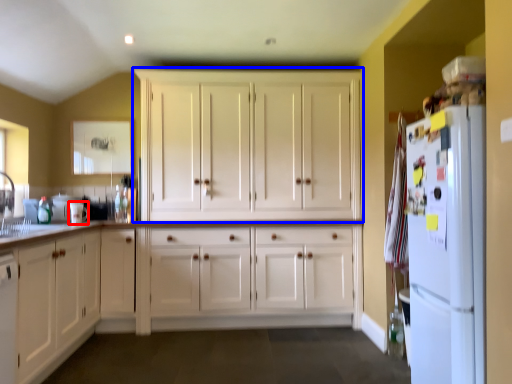
Question: Among these objects, which one is nearest to the camera, appliance (highlighted by a red box) or cabinetry (highlighted by a blue box)?

Choices:
 (A) appliance
 (B) cabinetry

Answer: (A)